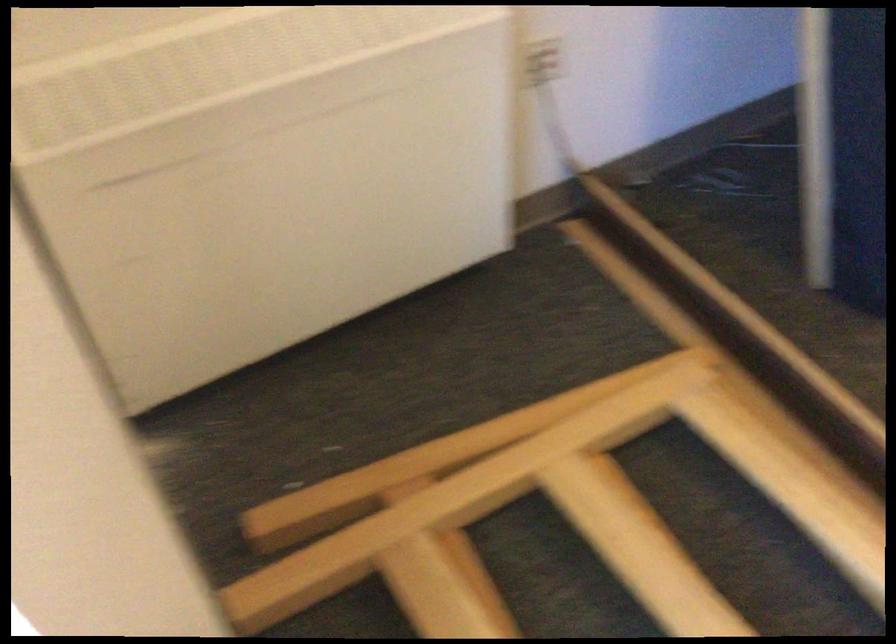
Question: The first image is from the beginning of the video and the second image is from the end. How did the camera likely rotate when shooting the video?

Choices:
 (A) Left
 (B) Right
 (C) Up
 (D) Down

Answer: (B)